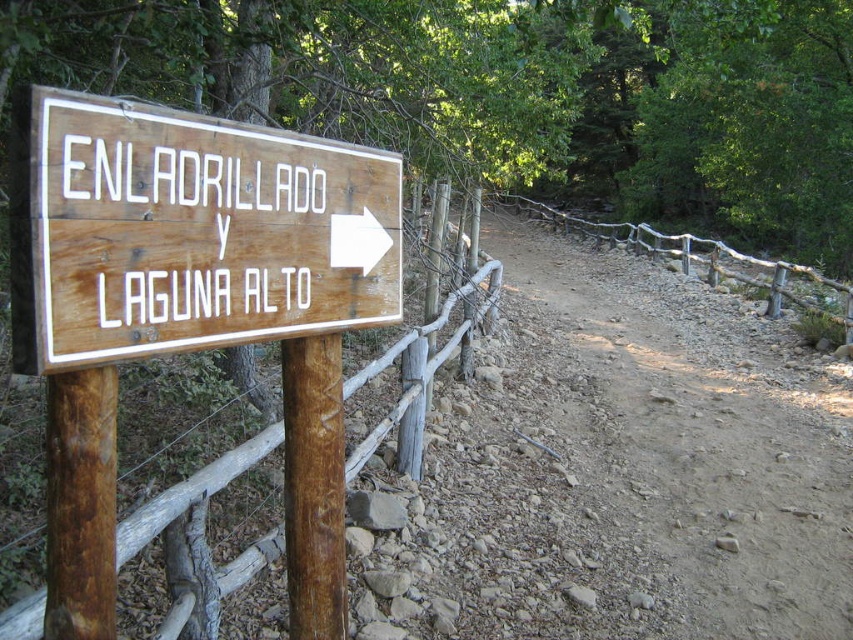
Question: Can you confirm if wooden sign at left is smaller than brown wood post at left?

Choices:
 (A) yes
 (B) no

Answer: (B)

Question: Which of the following is the farthest from the observer?

Choices:
 (A) brown wood post at left
 (B) wooden sign at left
 (C) wooden fence at left

Answer: (A)

Question: Estimate the real-world distances between objects in this image. Which object is closer to the wooden fence at left?

Choices:
 (A) brown wood post at left
 (B) wooden sign at left

Answer: (B)

Question: Can you confirm if wooden sign at left is positioned below brown wood post at left?

Choices:
 (A) no
 (B) yes

Answer: (A)

Question: Which of the following is the farthest from the observer?

Choices:
 (A) wooden fence at left
 (B) brown wood post at left
 (C) wooden sign at left

Answer: (B)

Question: Does wooden fence at left appear on the right side of brown wood post at left?

Choices:
 (A) no
 (B) yes

Answer: (B)